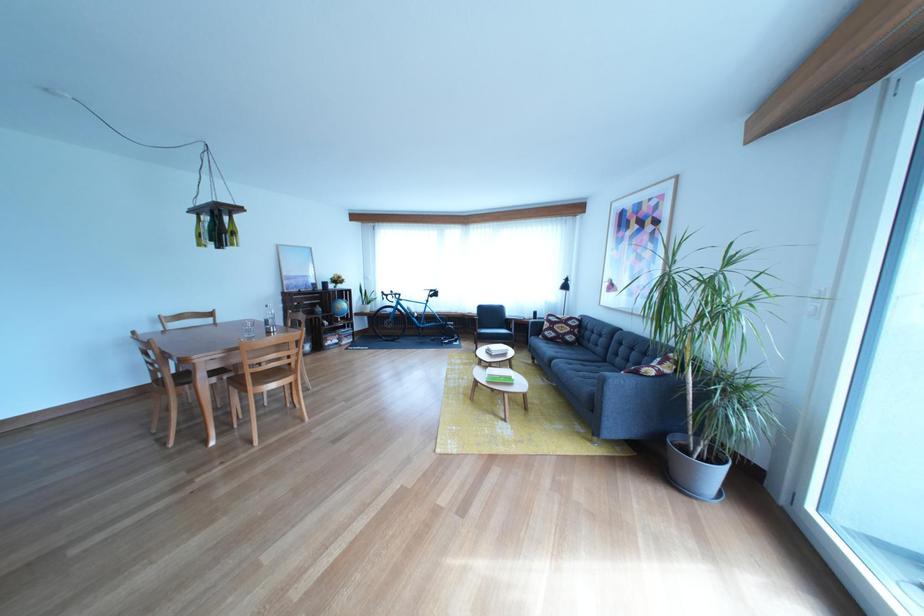
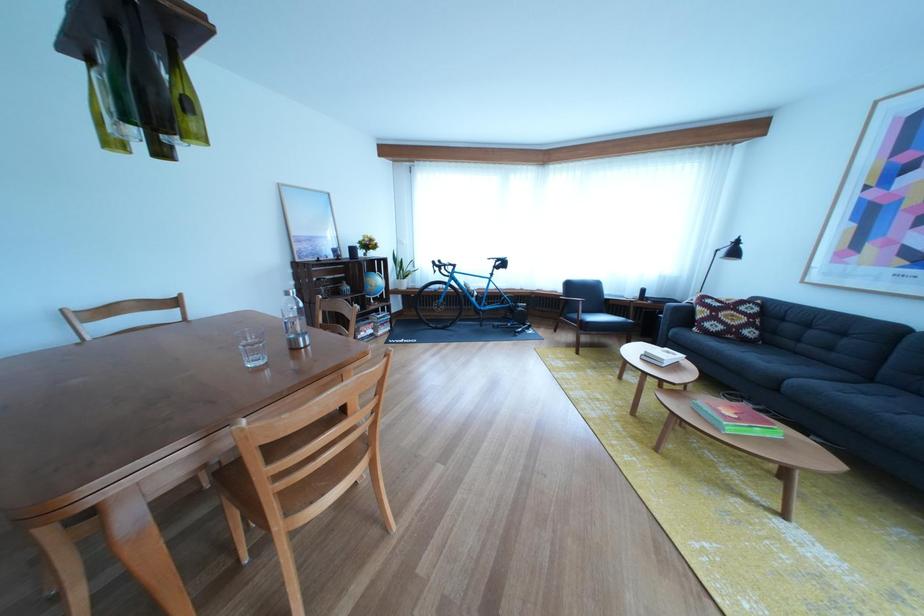
Which direction would the cameraman need to move to produce the second image?

The cameraman walked toward left, forward.